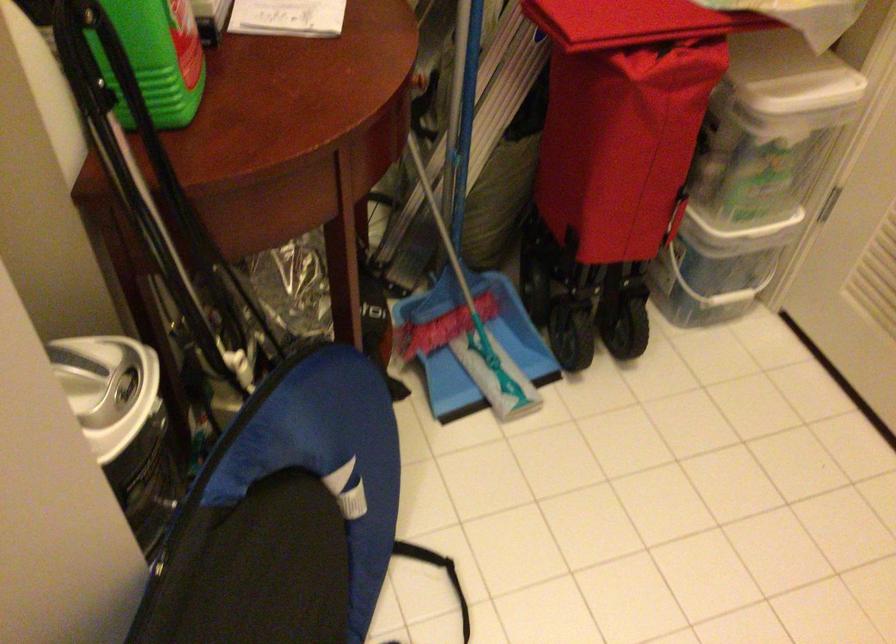
The image size is (896, 644). What do you see at coordinates (271, 569) in the screenshot?
I see `the chair sitting surface` at bounding box center [271, 569].